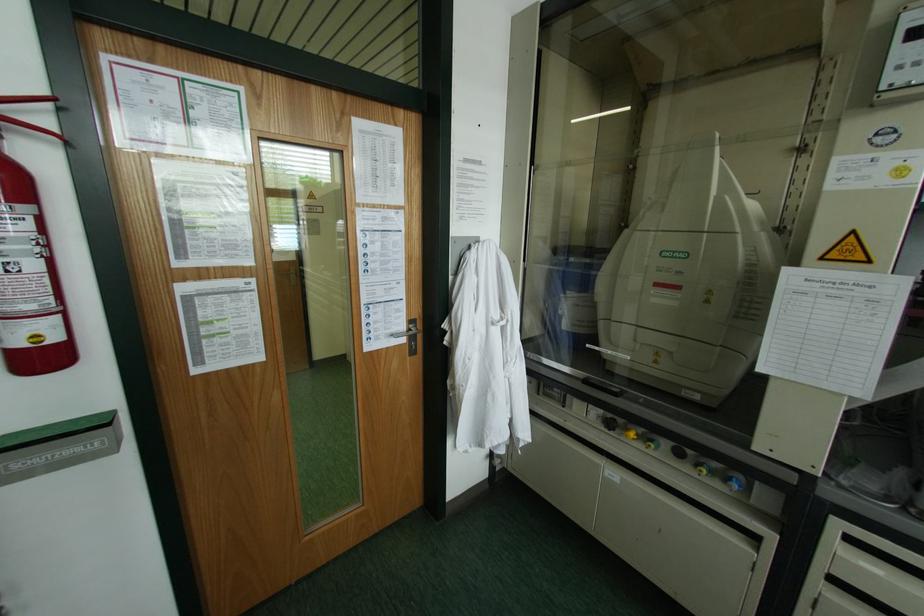
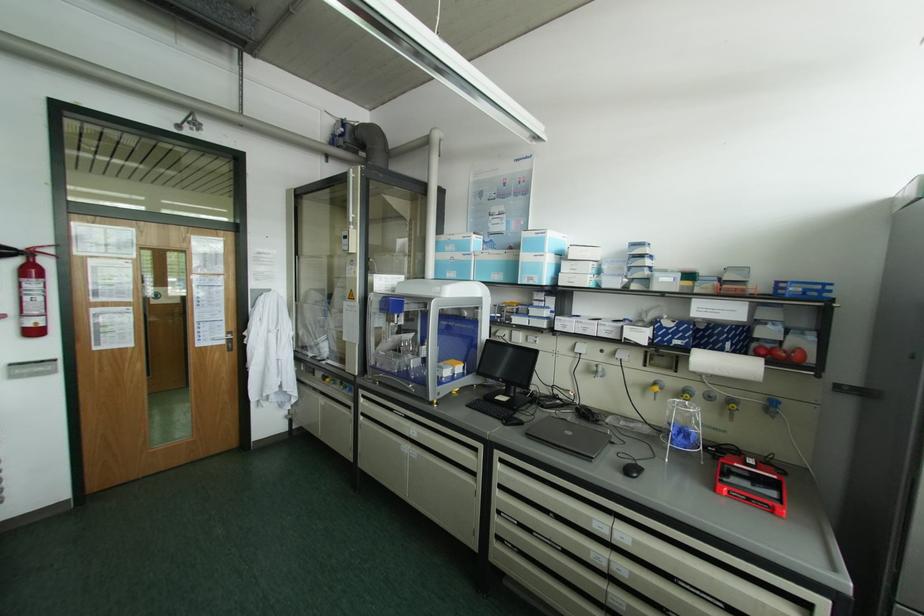
The point at (403, 339) is marked in the first image. Where is the corresponding point in the second image?

(224, 342)